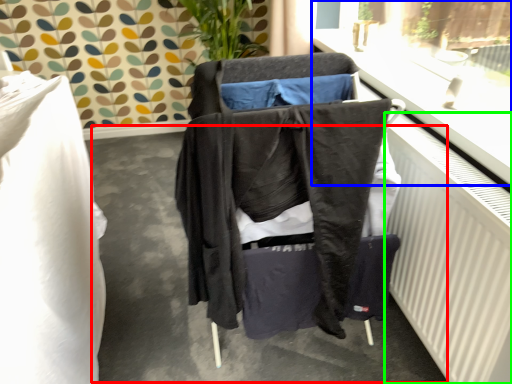
Question: Which object is the closest to the concrete (highlighted by a red box)? Choose among these: window frame (highlighted by a blue box) or radiator (highlighted by a green box).

Choices:
 (A) window frame
 (B) radiator

Answer: (B)